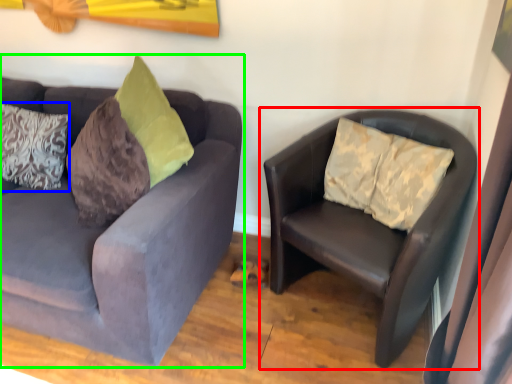
Question: Which object is positioned closest to studio couch (highlighted by a red box)? Select from pillow (highlighted by a blue box) and studio couch (highlighted by a green box).

Choices:
 (A) pillow
 (B) studio couch

Answer: (B)